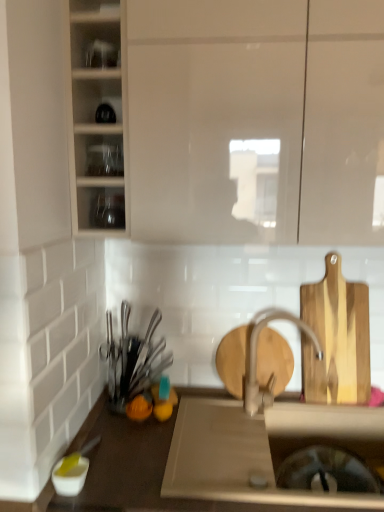
Where is `free space to the right of white glossy bowl at lower left, the first tableware from the bottom`? This screenshot has width=384, height=512. free space to the right of white glossy bowl at lower left, the first tableware from the bottom is located at coordinates [134, 478].